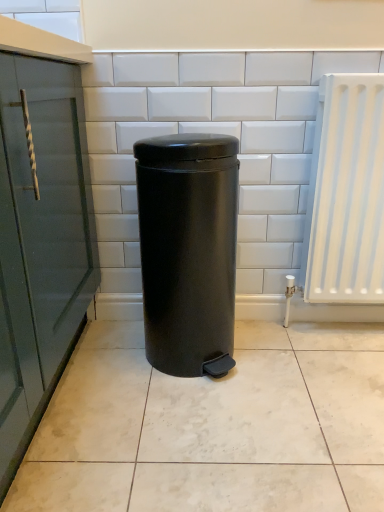
The height and width of the screenshot is (512, 384). In order to click on matte black trash can at center in this screenshot , I will do `click(188, 250)`.

This screenshot has width=384, height=512. What do you see at coordinates (188, 250) in the screenshot? I see `matte black trash can at center` at bounding box center [188, 250].

Find the location of `matte black trash can at center`. matte black trash can at center is located at coordinates (188, 250).